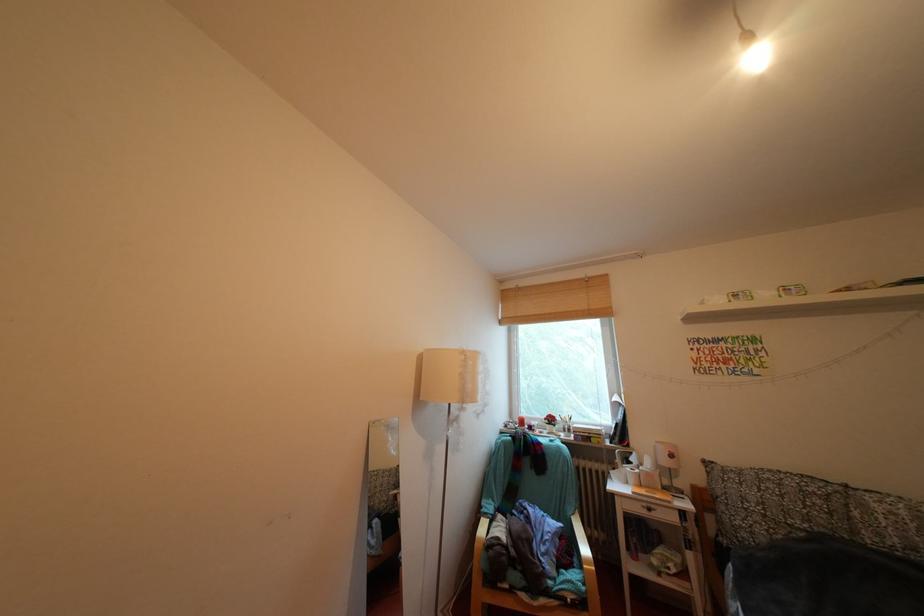
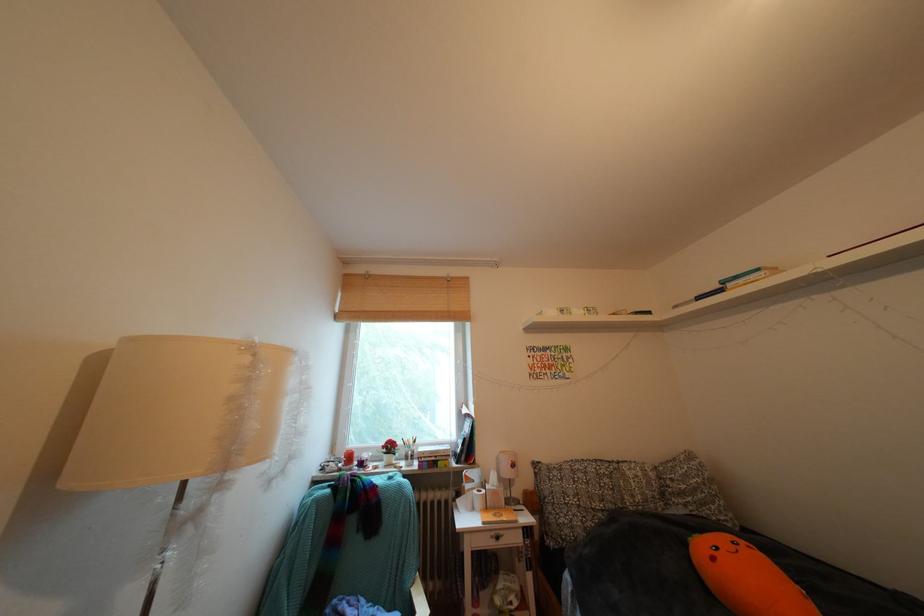
In the second image, find the point that corresponds to point 473,358 in the first image.

(259, 353)